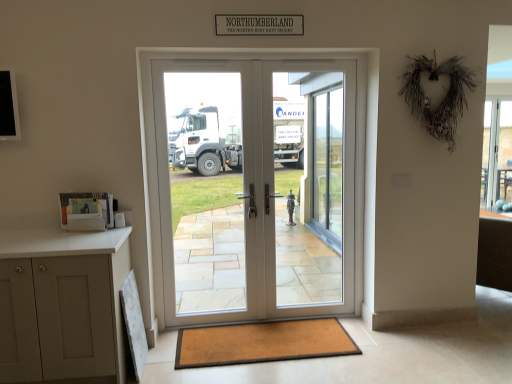
Question: Is point (486, 145) closer or farther from the camera than point (349, 259)?

Choices:
 (A) closer
 (B) farther

Answer: (A)

Question: From a real-world perspective, relative to white glossy screen door at center, positioned as the 1th screen door in right-to-left order, is clear glass window at right vertically above or below?

Choices:
 (A) above
 (B) below

Answer: (B)

Question: Which is nearer to the clear glass door at center?

Choices:
 (A) white glossy door at center, which is the first screen door in left-to-right order
 (B) clear glass window at right
 (C) white glossy screen door at center, acting as the second screen door starting from the left
 (D) white glossy door at center
 (E) brown textured mat at lower center

Answer: (C)

Question: Which object is the closest to the white glossy door at center, the second screen door positioned from the right?

Choices:
 (A) brown textured mat at lower center
 (B) white glossy door at center
 (C) white glossy screen door at center, acting as the second screen door starting from the left
 (D) clear glass window at right
 (E) clear glass door at center

Answer: (C)